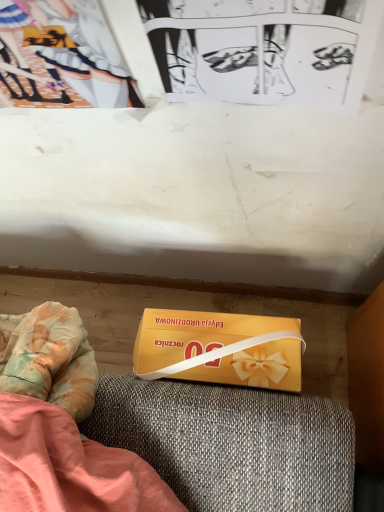
Describe the element at coordinates (61, 57) in the screenshot. I see `matte paper couple at upper left` at that location.

What are the coordinates of `matte paper couple at upper left` in the screenshot? It's located at (61, 57).

Which object is more forward, matte paper couple at upper left or black paper at upper center?

black paper at upper center.

Is matte paper couple at upper left beside black paper at upper center?

No, matte paper couple at upper left is not touching black paper at upper center.

Consider the image. Does matte paper couple at upper left have a lesser width compared to black paper at upper center?

No, matte paper couple at upper left is not thinner than black paper at upper center.

Find the location of a particular element. box beneath the black paper at upper center (from a real-world perspective) is located at coordinates (220, 348).

Is the position of black paper at upper center less distant than that of yellow matte box at lower center?

Yes, it is.

Which is in front, point (200, 94) or point (274, 333)?

The point (200, 94) is more forward.

Consider the image. Does black paper at upper center have a larger size compared to yellow matte box at lower center?

Incorrect, black paper at upper center is not larger than yellow matte box at lower center.

Who is bigger, yellow matte box at lower center or matte paper couple at upper left?

yellow matte box at lower center.

Considering the positions of points (250, 332) and (76, 22), is point (250, 332) farther from camera compared to point (76, 22)?

Yes, it is.

This screenshot has height=512, width=384. Identify the location of box located below the matte paper couple at upper left (from the image's perspective). (220, 348).

Can you tell me how much yellow matte box at lower center and matte paper couple at upper left differ in facing direction?

0.794 degrees.

Considering the positions of points (262, 379) and (199, 37), is point (262, 379) farther from camera compared to point (199, 37)?

Yes.

Identify the location of paperback book that appears above the yellow matte box at lower center (from a real-world perspective). (264, 49).

Is the surface of yellow matte box at lower center in direct contact with black paper at upper center?

There is a gap between yellow matte box at lower center and black paper at upper center.

What's the angular difference between yellow matte box at lower center and black paper at upper center's facing directions?

0.0508 degrees.

Is matte paper couple at upper left to the left of yellow matte box at lower center from the viewer's perspective?

Yes.

Would you consider matte paper couple at upper left to be distant from yellow matte box at lower center?

matte paper couple at upper left is near yellow matte box at lower center, not far away.

From the image's perspective, between matte paper couple at upper left and yellow matte box at lower center, who is located below?

yellow matte box at lower center.

Is point (25, 32) closer to viewer compared to point (211, 355)?

Yes, point (25, 32) is closer to viewer.

Is black paper at upper center in front of matte paper couple at upper left?

Yes, black paper at upper center is closer to the viewer.

From the image's perspective, is black paper at upper center located beneath matte paper couple at upper left?

Indeed, from the image's perspective, black paper at upper center is shown beneath matte paper couple at upper left.

From a real-world perspective, is black paper at upper center above or below matte paper couple at upper left?

Clearly, from a real-world perspective, black paper at upper center is above matte paper couple at upper left.

How distant is black paper at upper center from matte paper couple at upper left?

black paper at upper center and matte paper couple at upper left are 5.06 inches apart from each other.

Identify the location of paperback book below the matte paper couple at upper left (from the image's perspective). (264, 49).

In the image, there is a black paper at upper center. Identify the location of box below it (from a real-world perspective). This screenshot has height=512, width=384. (220, 348).

Looking at the image, which one is located closer to yellow matte box at lower center, black paper at upper center or matte paper couple at upper left?

black paper at upper center.

Looking at the image, which one is located closer to matte paper couple at upper left, black paper at upper center or yellow matte box at lower center?

Based on the image, black paper at upper center appears to be nearer to matte paper couple at upper left.

Based on their spatial positions, is yellow matte box at lower center or black paper at upper center further from matte paper couple at upper left?

yellow matte box at lower center is further to matte paper couple at upper left.

Based on their spatial positions, is yellow matte box at lower center or matte paper couple at upper left further from black paper at upper center?

yellow matte box at lower center is positioned further to the anchor black paper at upper center.

From the image, which object appears to be farther from yellow matte box at lower center, matte paper couple at upper left or black paper at upper center?

matte paper couple at upper left is positioned further to the anchor yellow matte box at lower center.

Considering their positions, is matte paper couple at upper left positioned further to black paper at upper center than yellow matte box at lower center?

The object further to black paper at upper center is yellow matte box at lower center.

At what (x,y) coordinates should I click in order to perform the action: click on couple between black paper at upper center and yellow matte box at lower center along the z-axis. Please return your answer as a coordinate pair (x, y). The width and height of the screenshot is (384, 512). Looking at the image, I should click on (61, 57).